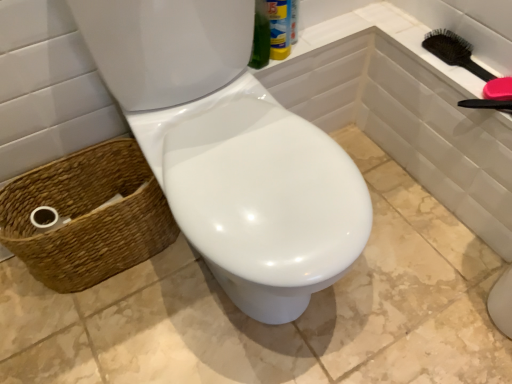
Question: From the image's perspective, is black plastic hairbrush at upper right located beneath woven brown basket at lower left?

Choices:
 (A) no
 (B) yes

Answer: (A)

Question: Can you confirm if black plastic hairbrush at upper right is thinner than woven brown basket at lower left?

Choices:
 (A) no
 (B) yes

Answer: (B)

Question: From the image's perspective, is black plastic hairbrush at upper right located above woven brown basket at lower left?

Choices:
 (A) yes
 (B) no

Answer: (A)

Question: From a real-world perspective, does black plastic hairbrush at upper right stand above woven brown basket at lower left?

Choices:
 (A) yes
 (B) no

Answer: (A)

Question: Is black plastic hairbrush at upper right aimed at woven brown basket at lower left?

Choices:
 (A) no
 (B) yes

Answer: (A)

Question: Is black plastic hairbrush at upper right shorter than woven brown basket at lower left?

Choices:
 (A) no
 (B) yes

Answer: (B)

Question: Considering the relative sizes of white glossy toilet at center and black plastic hairbrush at upper right in the image provided, is white glossy toilet at center smaller than black plastic hairbrush at upper right?

Choices:
 (A) yes
 (B) no

Answer: (B)

Question: Is white glossy toilet at center behind black plastic hairbrush at upper right?

Choices:
 (A) yes
 (B) no

Answer: (B)

Question: From a real-world perspective, does white glossy toilet at center sit lower than black plastic hairbrush at upper right?

Choices:
 (A) no
 (B) yes

Answer: (B)

Question: Would you say white glossy toilet at center is a long distance from black plastic hairbrush at upper right?

Choices:
 (A) yes
 (B) no

Answer: (B)

Question: Is white glossy toilet at center looking in the opposite direction of black plastic hairbrush at upper right?

Choices:
 (A) no
 (B) yes

Answer: (A)

Question: Is white glossy toilet at center facing towards black plastic hairbrush at upper right?

Choices:
 (A) no
 (B) yes

Answer: (B)

Question: Are woven brown basket at lower left and white glossy toilet at center located far from each other?

Choices:
 (A) yes
 (B) no

Answer: (B)